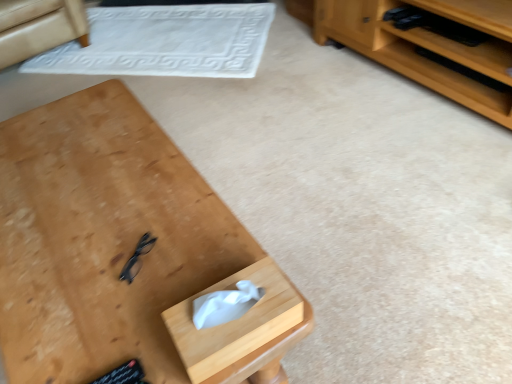
Locate an element on the screen. free space above white textured mat at upper center (from a real-world perspective) is located at coordinates (159, 29).